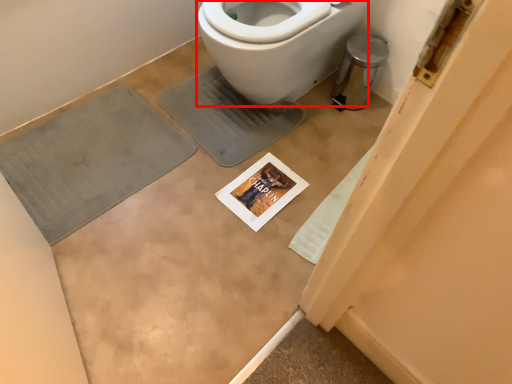
Question: Considering the relative positions of bidet (annotated by the red box) and bath mat in the image provided, where is bidet (annotated by the red box) located with respect to the staircase?

Choices:
 (A) left
 (B) right

Answer: (B)